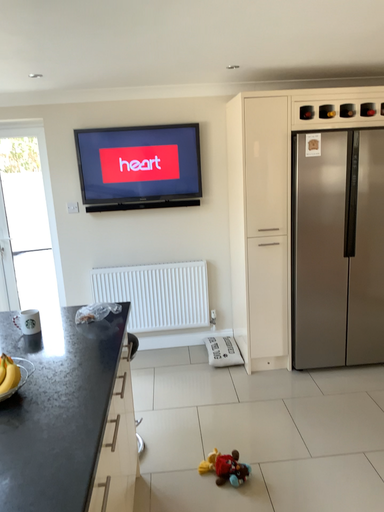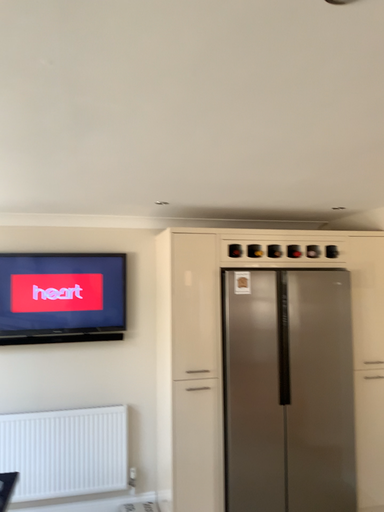
Question: Which way did the camera rotate in the video?

Choices:
 (A) rotated upward
 (B) rotated downward

Answer: (A)